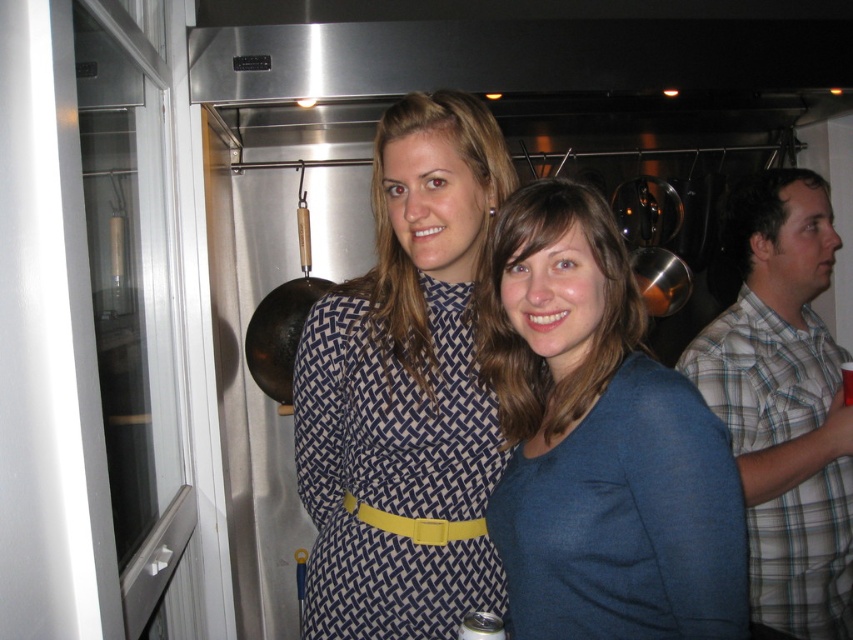
Is blue cotton shirt at center to the left of blue matte dress at center from the viewer's perspective?

No, blue cotton shirt at center is not to the left of blue matte dress at center.

Is point (671, 408) farther from viewer compared to point (520, 259)?

No, it is not.

The width and height of the screenshot is (853, 640). In order to click on blue cotton shirt at center in this screenshot , I will do `click(599, 442)`.

Find the location of `blue cotton shirt at center`. blue cotton shirt at center is located at coordinates (599, 442).

Is point (751, 262) positioned behind point (471, 129)?

That is True.

Identify the location of plaid shirt at right. This screenshot has width=853, height=640. (785, 404).

This screenshot has width=853, height=640. What do you see at coordinates (393, 470) in the screenshot? I see `blue woven fabric dress at center` at bounding box center [393, 470].

Find the location of a particular element. blue woven fabric dress at center is located at coordinates (393, 470).

Find the location of `blue woven fabric dress at center`. blue woven fabric dress at center is located at coordinates (393, 470).